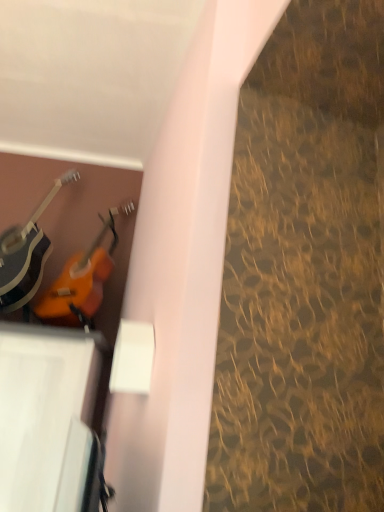
The width and height of the screenshot is (384, 512). What are the coordinates of `orange glossy guitar at upper left, placed as the first guitar when sorted from right to left` in the screenshot? It's located at (82, 279).

Image resolution: width=384 pixels, height=512 pixels. Describe the element at coordinates (82, 279) in the screenshot. I see `orange glossy guitar at upper left, which ranks as the 2th guitar in left-to-right order` at that location.

What do you see at coordinates (26, 254) in the screenshot? Image resolution: width=384 pixels, height=512 pixels. I see `matte black guitar at left, the first guitar in the left-to-right sequence` at bounding box center [26, 254].

Where is `matte black guitar at left, the first guitar in the left-to-right sequence`? The image size is (384, 512). matte black guitar at left, the first guitar in the left-to-right sequence is located at coordinates (26, 254).

Measure the distance between point (x=30, y=251) and camera.

Point (x=30, y=251) and camera are 2.71 meters apart.

What is the approximate height of matte black guitar at left, the first guitar in the left-to-right sequence?

The height of matte black guitar at left, the first guitar in the left-to-right sequence, is 39.23 inches.

Locate an element on the screen. This screenshot has height=512, width=384. orange glossy guitar at upper left, placed as the first guitar when sorted from right to left is located at coordinates (82, 279).

Is orange glossy guitar at upper left, which ranks as the 2th guitar in left-to-right order, to the right of matte black guitar at left, the first guitar in the left-to-right sequence, from the viewer's perspective?

Yes.

Is the position of orange glossy guitar at upper left, which ranks as the 2th guitar in left-to-right order, more distant than that of matte black guitar at left, the 2th guitar when ordered from right to left?

Yes, orange glossy guitar at upper left, which ranks as the 2th guitar in left-to-right order, is behind matte black guitar at left, the 2th guitar when ordered from right to left.

Considering the points (77, 270) and (28, 301), which point is in front, point (77, 270) or point (28, 301)?

The point (77, 270) is more forward.

From the image's perspective, would you say orange glossy guitar at upper left, placed as the first guitar when sorted from right to left, is shown under matte black guitar at left, the first guitar in the left-to-right sequence?

Correct, orange glossy guitar at upper left, placed as the first guitar when sorted from right to left, appears lower than matte black guitar at left, the first guitar in the left-to-right sequence, in the image.

From a real-world perspective, is orange glossy guitar at upper left, placed as the first guitar when sorted from right to left, physically located above or below matte black guitar at left, the 2th guitar when ordered from right to left?

From a real-world perspective, orange glossy guitar at upper left, placed as the first guitar when sorted from right to left, is physically below matte black guitar at left, the 2th guitar when ordered from right to left.

Does orange glossy guitar at upper left, placed as the first guitar when sorted from right to left, have a lesser width compared to matte black guitar at left, the 2th guitar when ordered from right to left?

Yes.

In terms of height, does orange glossy guitar at upper left, placed as the first guitar when sorted from right to left, look taller or shorter compared to matte black guitar at left, the 2th guitar when ordered from right to left?

Clearly, orange glossy guitar at upper left, placed as the first guitar when sorted from right to left, is shorter compared to matte black guitar at left, the 2th guitar when ordered from right to left.

In the scene shown: Who is smaller, orange glossy guitar at upper left, placed as the first guitar when sorted from right to left, or matte black guitar at left, the first guitar in the left-to-right sequence?

orange glossy guitar at upper left, placed as the first guitar when sorted from right to left, is smaller.

Is matte black guitar at left, the first guitar in the left-to-right sequence, located within orange glossy guitar at upper left, placed as the first guitar when sorted from right to left?

No.

Is orange glossy guitar at upper left, which ranks as the 2th guitar in left-to-right order, next to matte black guitar at left, the first guitar in the left-to-right sequence, and touching it?

orange glossy guitar at upper left, which ranks as the 2th guitar in left-to-right order, is not next to matte black guitar at left, the first guitar in the left-to-right sequence, and they're not touching.

Is orange glossy guitar at upper left, placed as the first guitar when sorted from right to left, turned away from matte black guitar at left, the first guitar in the left-to-right sequence?

No, matte black guitar at left, the first guitar in the left-to-right sequence, is not at the back of orange glossy guitar at upper left, placed as the first guitar when sorted from right to left.

Can you tell me how much orange glossy guitar at upper left, which ranks as the 2th guitar in left-to-right order, and matte black guitar at left, the first guitar in the left-to-right sequence, differ in facing direction?

orange glossy guitar at upper left, which ranks as the 2th guitar in left-to-right order, and matte black guitar at left, the first guitar in the left-to-right sequence, are facing 3.37e-05 degrees away from each other.

Identify the location of guitar to the left of orange glossy guitar at upper left, which ranks as the 2th guitar in left-to-right order. (26, 254).

In the scene shown: Would you say matte black guitar at left, the first guitar in the left-to-right sequence, is to the left or to the right of orange glossy guitar at upper left, which ranks as the 2th guitar in left-to-right order, in the picture?

In the image, matte black guitar at left, the first guitar in the left-to-right sequence, appears on the left side of orange glossy guitar at upper left, which ranks as the 2th guitar in left-to-right order.

Does matte black guitar at left, the 2th guitar when ordered from right to left, come in front of orange glossy guitar at upper left, which ranks as the 2th guitar in left-to-right order?

A: Yes, it is.

Which is in front, point (9, 298) or point (105, 231)?

The point (9, 298) is closer to the camera.

From the image's perspective, is matte black guitar at left, the first guitar in the left-to-right sequence, located beneath orange glossy guitar at upper left, placed as the first guitar when sorted from right to left?

No, from the image's perspective, matte black guitar at left, the first guitar in the left-to-right sequence, is not beneath orange glossy guitar at upper left, placed as the first guitar when sorted from right to left.

From a real-world perspective, is matte black guitar at left, the 2th guitar when ordered from right to left, above or below orange glossy guitar at upper left, which ranks as the 2th guitar in left-to-right order?

matte black guitar at left, the 2th guitar when ordered from right to left, is above orange glossy guitar at upper left, which ranks as the 2th guitar in left-to-right order.

Looking at their sizes, would you say matte black guitar at left, the 2th guitar when ordered from right to left, is wider or thinner than orange glossy guitar at upper left, placed as the first guitar when sorted from right to left?

Considering their sizes, matte black guitar at left, the 2th guitar when ordered from right to left, looks broader than orange glossy guitar at upper left, placed as the first guitar when sorted from right to left.

Who is taller, matte black guitar at left, the first guitar in the left-to-right sequence, or orange glossy guitar at upper left, which ranks as the 2th guitar in left-to-right order?

matte black guitar at left, the first guitar in the left-to-right sequence, is taller.

Looking at this image, based on their sizes in the image, would you say matte black guitar at left, the first guitar in the left-to-right sequence, is bigger or smaller than orange glossy guitar at upper left, which ranks as the 2th guitar in left-to-right order?

In the image, matte black guitar at left, the first guitar in the left-to-right sequence, appears to be larger than orange glossy guitar at upper left, which ranks as the 2th guitar in left-to-right order.

Is orange glossy guitar at upper left, placed as the first guitar when sorted from right to left, located within matte black guitar at left, the first guitar in the left-to-right sequence?

No, orange glossy guitar at upper left, placed as the first guitar when sorted from right to left, is located outside of matte black guitar at left, the first guitar in the left-to-right sequence.

Is matte black guitar at left, the 2th guitar when ordered from right to left, next to orange glossy guitar at upper left, which ranks as the 2th guitar in left-to-right order, and touching it?

matte black guitar at left, the 2th guitar when ordered from right to left, and orange glossy guitar at upper left, which ranks as the 2th guitar in left-to-right order, are not in contact.

Is matte black guitar at left, the 2th guitar when ordered from right to left, facing away from orange glossy guitar at upper left, which ranks as the 2th guitar in left-to-right order?

matte black guitar at left, the 2th guitar when ordered from right to left, is not turned away from orange glossy guitar at upper left, which ranks as the 2th guitar in left-to-right order.

Where is `guitar below the matte black guitar at left, the first guitar in the left-to-right sequence (from the image's perspective)`? Image resolution: width=384 pixels, height=512 pixels. guitar below the matte black guitar at left, the first guitar in the left-to-right sequence (from the image's perspective) is located at coordinates (82, 279).

Identify the location of guitar above the orange glossy guitar at upper left, which ranks as the 2th guitar in left-to-right order (from a real-world perspective). (26, 254).

Locate an element on the screen. The image size is (384, 512). guitar below the matte black guitar at left, the 2th guitar when ordered from right to left (from the image's perspective) is located at coordinates (82, 279).